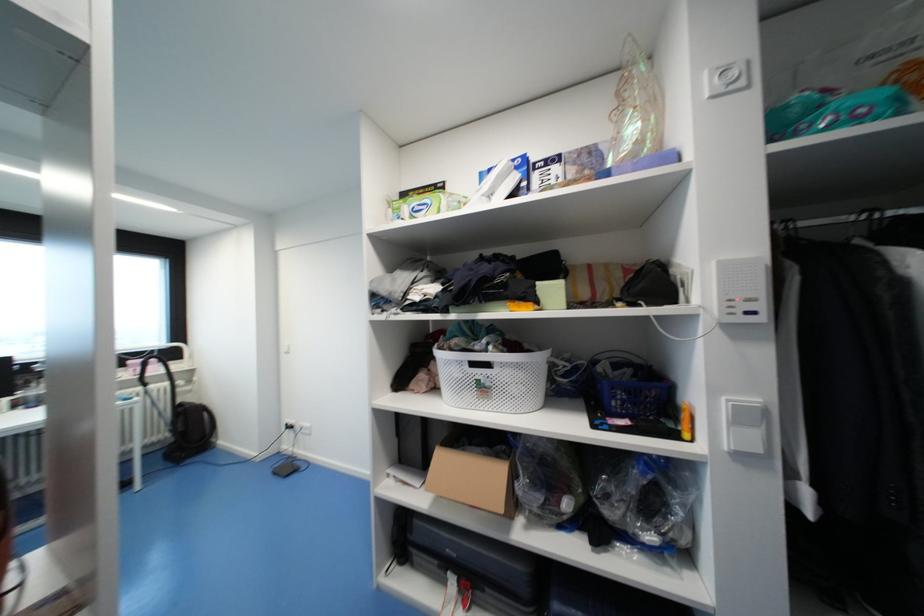
Image resolution: width=924 pixels, height=616 pixels. What do you see at coordinates (465, 573) in the screenshot?
I see `the suitcase handle` at bounding box center [465, 573].